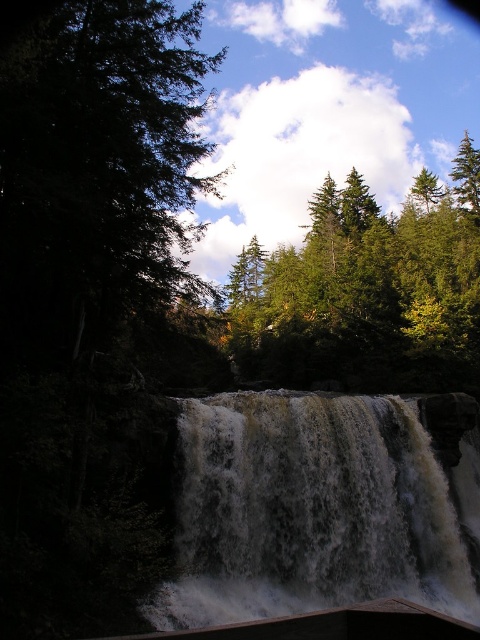
You are a photographer planning to capture the waterfall scene. You want to ensure that the green leafy tree at left and the white frothy water at center are both visible in your shot. Given their sizes, which object should you frame first to accommodate both?

The green leafy tree at left is wider than the white frothy water at center, so you should frame the green leafy tree at left first to ensure it fits in the shot while still allowing space for the white frothy water at center.

You are standing in front of the waterfall and want to take a photo of the green leafy tree at left. Where should you position yourself to capture it in the frame?

The green leafy tree at left is located at point (x=96, y=170), so you should position yourself to the left side of the scene to capture it in the frame.